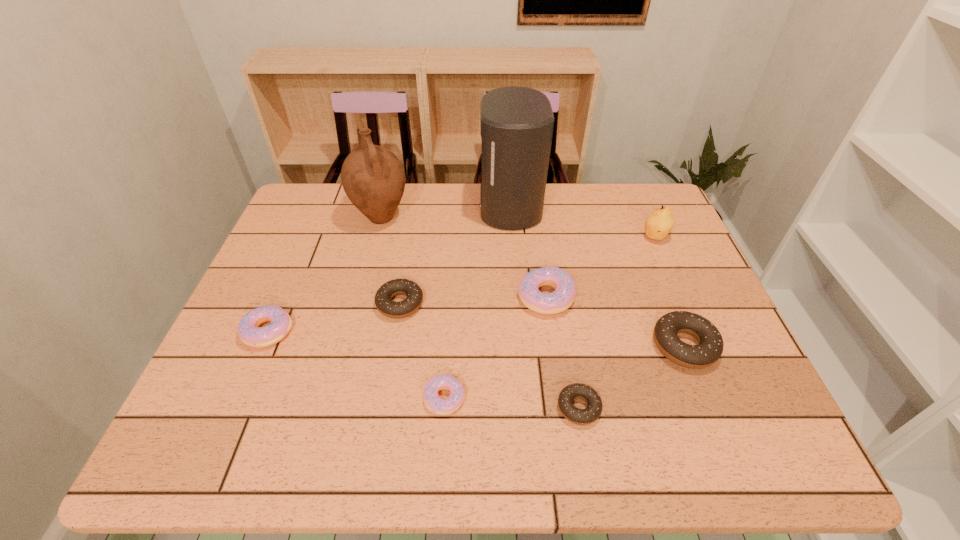
Find the location of a particular element. dark coffee maker is located at coordinates (516, 123).

Find the location of a particular element. brown pitcher is located at coordinates (373, 178).

This screenshot has height=540, width=960. I want to click on the eighth shortest object, so click(x=373, y=178).

Find the location of a particular element. the seventh shortest object is located at coordinates (659, 223).

Locate an element on the screen. the biggest pink doughnut is located at coordinates (562, 298).

I want to click on the rightmost brown doughnut, so click(710, 345).

Find the location of a particular element. Image resolution: width=960 pixels, height=540 pixels. the biggest brown doughnut is located at coordinates (710, 345).

Find the location of a particular element. This screenshot has width=960, height=540. the leftmost doughnut is located at coordinates (250, 333).

You are a GUI agent. You are given a task and a screenshot of the screen. Output one action in this format:
    pyautogui.click(x=<x>, y=<y>)
    Task: Click on the leftmost pink doughnut
    The height and width of the screenshot is (540, 960).
    Given the screenshot: What is the action you would take?
    pyautogui.click(x=250, y=333)

I want to click on the second smallest brown doughnut, so click(x=384, y=304).